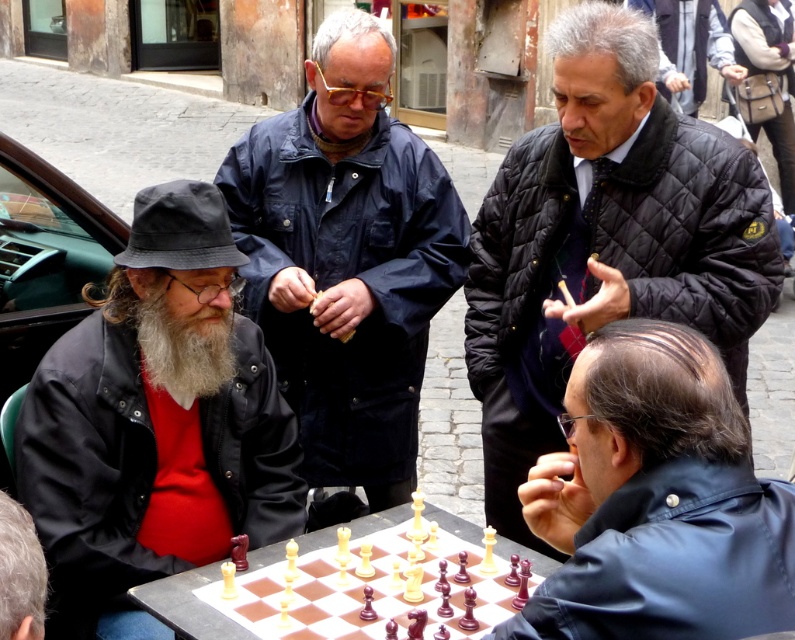
Question: Does quilted black jacket at upper right lie in front of shiny black jacket at lower right?

Choices:
 (A) no
 (B) yes

Answer: (A)

Question: Does dark blue jacket at center appear under shiny black jacket at lower right?

Choices:
 (A) yes
 (B) no

Answer: (B)

Question: Considering the real-world distances, which object is closest to the matte black jacket at left?

Choices:
 (A) dark blue jacket at center
 (B) wooden chess set at center
 (C) graywoollybeard at left
 (D) shiny black jacket at lower right

Answer: (C)

Question: Based on their relative distances, which object is farther from the gray woolen hat at lower left?

Choices:
 (A) graywoollybeard at left
 (B) matte black jacket at left
 (C) wooden chess set at center

Answer: (A)

Question: Among these points, which one is nearest to the camera?

Choices:
 (A) (297, 624)
 (B) (673, 65)
 (C) (487, 380)

Answer: (A)

Question: In this image, where is shiny black jacket at lower right located relative to dark gray quilted jacket at upper right?

Choices:
 (A) below
 (B) above

Answer: (A)